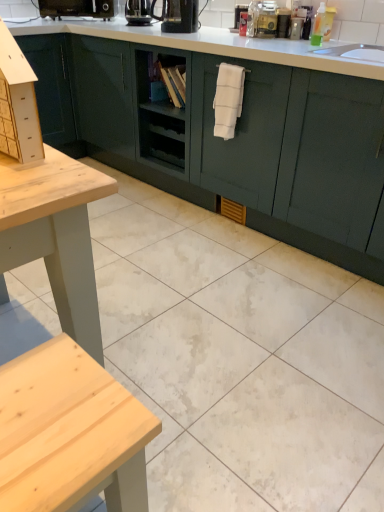
This screenshot has width=384, height=512. I want to click on free point behind translucent plastic bottle at upper right, so click(x=317, y=40).